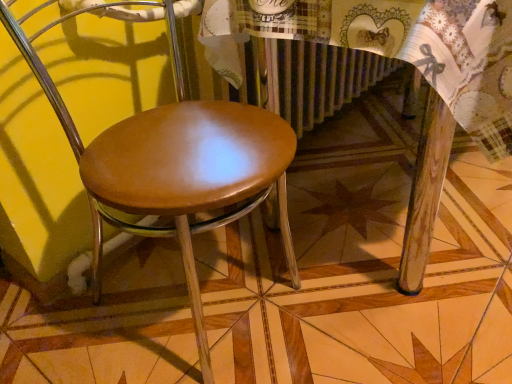
Question: Is shiny brown wood chair at center wider or thinner than wooden table at center?

Choices:
 (A) thin
 (B) wide

Answer: (A)

Question: Based on their sizes in the image, would you say shiny brown wood chair at center is bigger or smaller than wooden table at center?

Choices:
 (A) small
 (B) big

Answer: (A)

Question: From a real-world perspective, is shiny brown wood chair at center above or below wooden table at center?

Choices:
 (A) above
 (B) below

Answer: (A)

Question: Considering the relative positions of wooden table at center and shiny brown wood chair at center in the image provided, is wooden table at center to the left or to the right of shiny brown wood chair at center?

Choices:
 (A) right
 (B) left

Answer: (A)

Question: Is wooden table at center taller or shorter than shiny brown wood chair at center?

Choices:
 (A) tall
 (B) short

Answer: (B)

Question: Do you think wooden table at center is within shiny brown wood chair at center, or outside of it?

Choices:
 (A) outside
 (B) inside

Answer: (A)

Question: From the image's perspective, is wooden table at center positioned above or below shiny brown wood chair at center?

Choices:
 (A) above
 (B) below

Answer: (A)